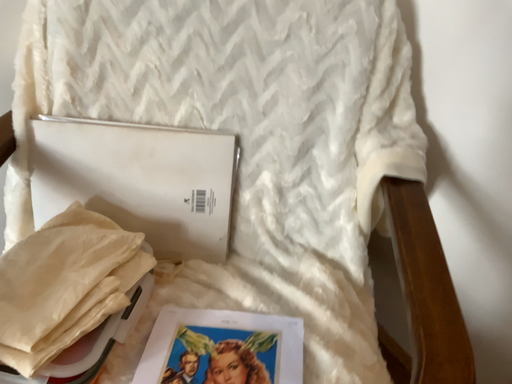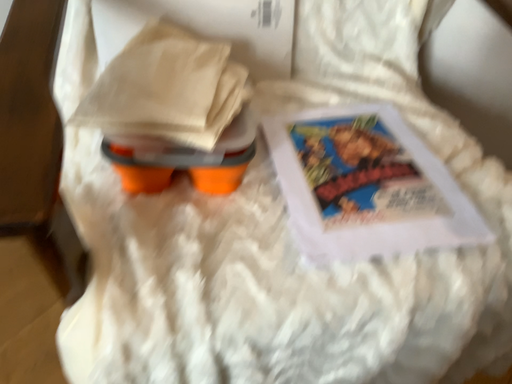
Question: How did the camera likely rotate when shooting the video?

Choices:
 (A) rotated left
 (B) rotated right

Answer: (B)